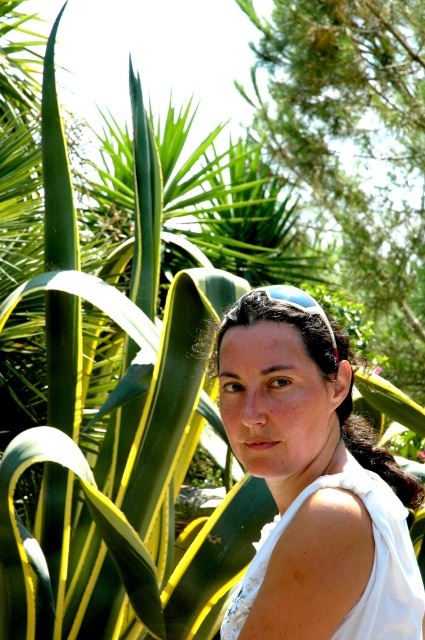
Question: Among these points, which one is farthest from the camera?

Choices:
 (A) (416, 570)
 (B) (331, 592)

Answer: (A)

Question: Which of the following is the closest to the observer?

Choices:
 (A) (405, 499)
 (B) (260, 579)

Answer: (B)

Question: Which object is closer to the camera taking this photo?

Choices:
 (A) white fabric at center
 (B) white cotton dress at right

Answer: (A)

Question: Does white fabric at center appear on the left side of white cotton dress at right?

Choices:
 (A) no
 (B) yes

Answer: (B)

Question: Is white fabric at center to the right of white cotton dress at right from the viewer's perspective?

Choices:
 (A) no
 (B) yes

Answer: (A)

Question: Is white fabric at center to the right of white cotton dress at right from the viewer's perspective?

Choices:
 (A) yes
 (B) no

Answer: (B)